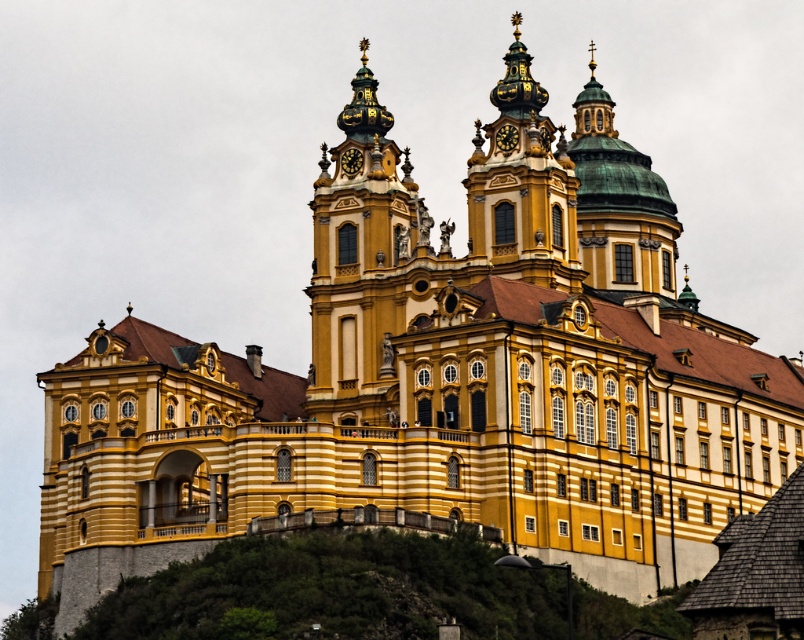
Who is more forward, (577, 269) or (589, 186)?

Point (577, 269) is more forward.

Between gold ornate clock tower at upper center and green copper dome at upper center, which one appears on the right side from the viewer's perspective?

green copper dome at upper center is more to the right.

Image resolution: width=804 pixels, height=640 pixels. I want to click on gold ornate clock tower at upper center, so pos(522,186).

Does golden stone tower at center appear over green copper dome at upper center?

No, golden stone tower at center is not above green copper dome at upper center.

Is golden stone tower at center bigger than green copper dome at upper center?

No.

Find the location of `golden stone tower at center`. golden stone tower at center is located at coordinates (364, 266).

Identify the location of golden stone tower at center. (364, 266).

Based on the photo, does golden stone tower at center have a smaller size compared to gold ornate clock tower at upper center?

No, golden stone tower at center is not smaller than gold ornate clock tower at upper center.

Is golden stone tower at center wider than gold ornate clock tower at upper center?

Correct, the width of golden stone tower at center exceeds that of gold ornate clock tower at upper center.

Who is more forward, [384,228] or [548,186]?

Point [548,186]

This screenshot has height=640, width=804. Find the location of `golden stone tower at center`. golden stone tower at center is located at coordinates (364, 266).